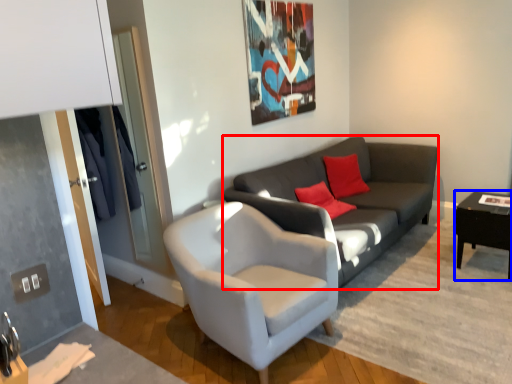
Question: Which point is closer to the camera, studio couch (highlighted by a red box) or table (highlighted by a blue box)?

Choices:
 (A) studio couch
 (B) table

Answer: (A)